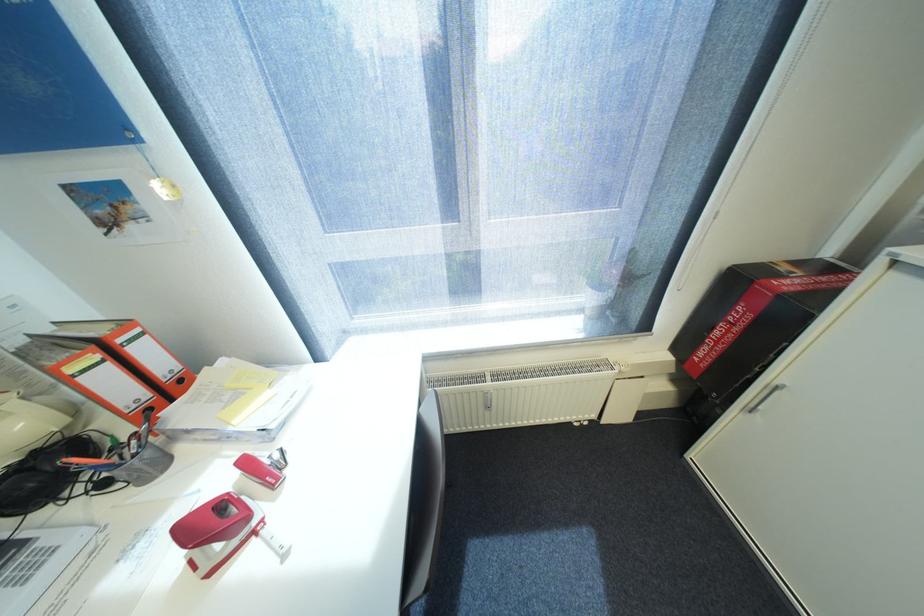
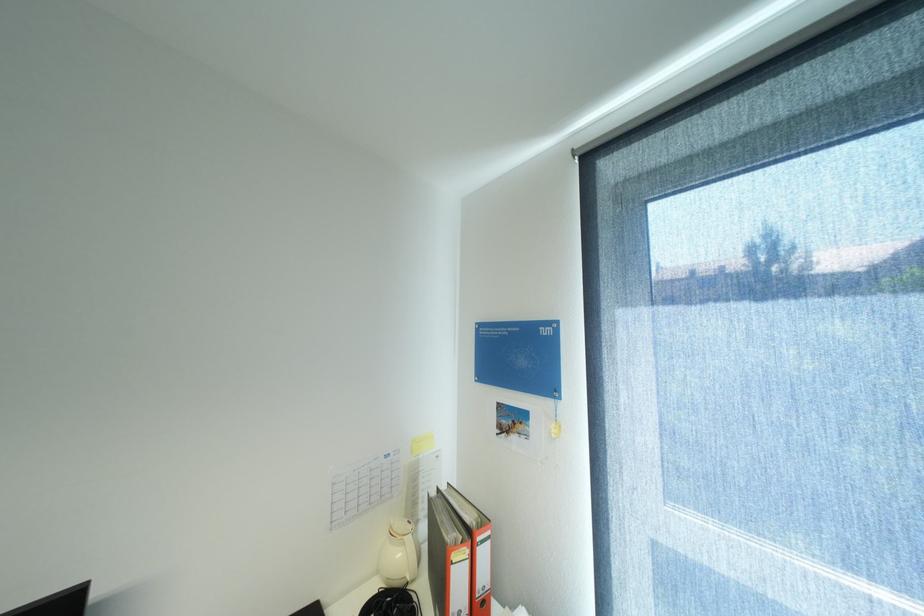
In the second image, find the point that corresponds to point 30,424 in the first image.

(407, 554)